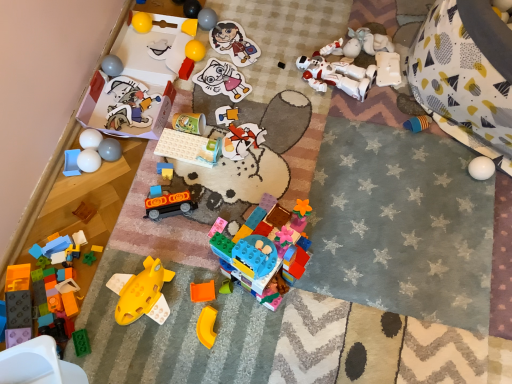
At what (x,y) coordinates should I click in order to perform the action: click on vacant space behind white matte robot at center, marked as the third toy in a right-to-left arrangement. Please return your answer as a coordinate pair (x, y). The image size is (512, 384). Looking at the image, I should click on (324, 26).